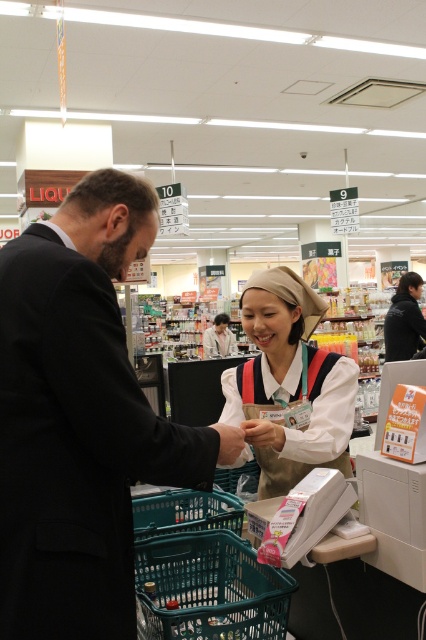
You are a customer at the supermarket and you see the white fabric uniform at center and the black fabric jacket at upper right. Which one is closer to the ceiling?

The black fabric jacket at upper right is closer to the ceiling because it is positioned above the white fabric uniform at center.

You are standing at the entrance of the supermarket and want to reach the point marked at coordinates point (66,572). If you walk straight ahead, will you reach that point before walking 4 feet?

The distance of point (66,572) from camera is 3.39 feet, so yes, you will reach the point before walking 4 feet since it is closer than that distance.

You are a customer standing in the supermarket checkout line. You see a black suit at left and a white fabric uniform at center. Which one is positioned more to the left side?

The black suit at left is positioned more to the left side than the white fabric uniform at center.